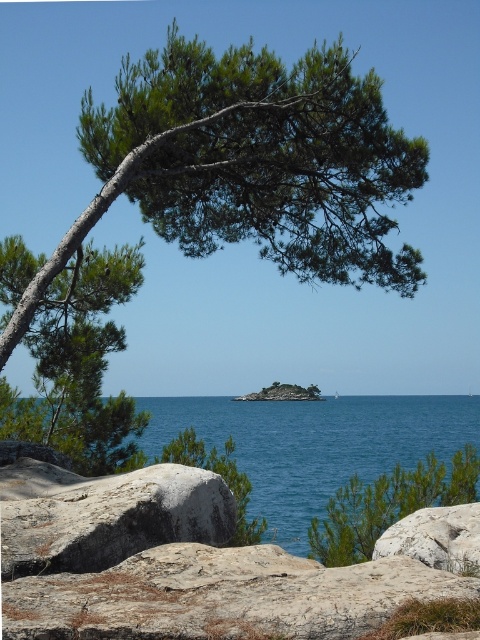
Question: Is smooth gray rock at center above blue water at center?

Choices:
 (A) yes
 (B) no

Answer: (A)

Question: Which of the following is the farthest from the observer?

Choices:
 (A) smooth gray rock at center
 (B) gray rough boulder at lower left
 (C) smooth gray rock at lower right

Answer: (C)

Question: Observing the image, what is the correct spatial positioning of smooth gray rock at center in reference to blue water at center?

Choices:
 (A) above
 (B) below

Answer: (A)

Question: Does blue water at center have a larger size compared to smooth gray rock at lower right?

Choices:
 (A) yes
 (B) no

Answer: (A)

Question: Considering the real-world distances, which object is closest to the smooth gray rock at lower right?

Choices:
 (A) green needle-like leaves at upper left
 (B) gray rough boulder at lower left
 (C) smooth gray rock at center

Answer: (C)

Question: Which object is the closest to the smooth gray rock at lower right?

Choices:
 (A) green needle-like leaves at upper left
 (B) smooth gray rock at center
 (C) blue water at center

Answer: (B)